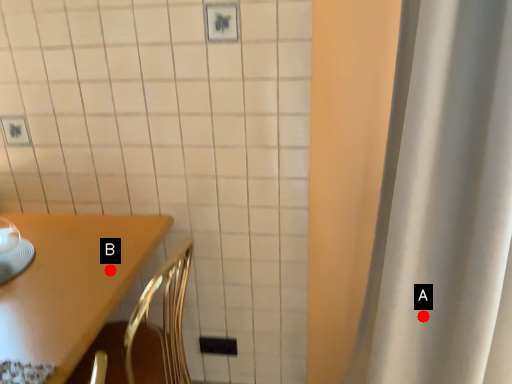
Question: Two points are circled on the image, labeled by A and B beside each circle. Among these points, which one is nearest to the camera?

Choices:
 (A) A is closer
 (B) B is closer

Answer: (A)